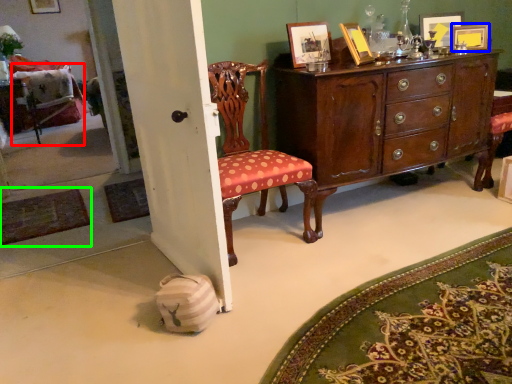
Question: Considering the real-world distances, which object is closest to swivel chair (highlighted by a red box)? picture frame (highlighted by a blue box) or mat (highlighted by a green box).

Choices:
 (A) picture frame
 (B) mat

Answer: (B)